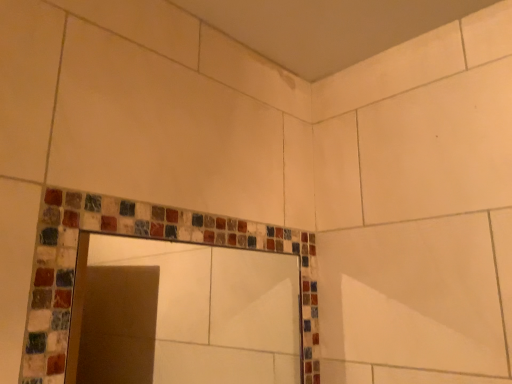
Where is `mosaic tile mirror at lower left`? The width and height of the screenshot is (512, 384). mosaic tile mirror at lower left is located at coordinates (183, 314).

The width and height of the screenshot is (512, 384). What do you see at coordinates (183, 314) in the screenshot?
I see `mosaic tile mirror at lower left` at bounding box center [183, 314].

The height and width of the screenshot is (384, 512). Find the location of `mosaic tile mirror at lower left`. mosaic tile mirror at lower left is located at coordinates (183, 314).